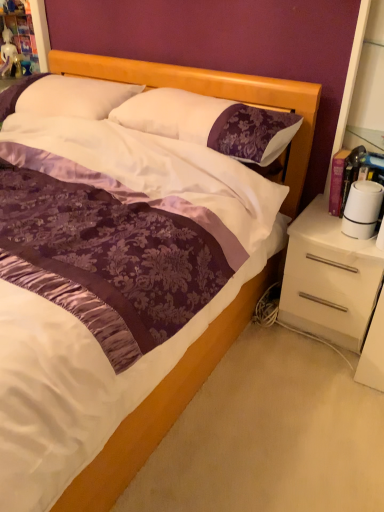
Question: Which direction should I rotate to face white satin pillow at upper center, acting as the second pillow starting from the right, — up or down?

Choices:
 (A) up
 (B) down

Answer: (A)

Question: Is white glossy drawer at right not close to white satin pillow at upper center, placed as the first pillow when sorted from left to right?

Choices:
 (A) yes
 (B) no

Answer: (A)

Question: Considering the relative sizes of white glossy drawer at right and white satin pillow at upper center, placed as the first pillow when sorted from left to right, in the image provided, is white glossy drawer at right shorter than white satin pillow at upper center, placed as the first pillow when sorted from left to right,?

Choices:
 (A) no
 (B) yes

Answer: (A)

Question: Can you confirm if white glossy drawer at right is wider than white satin pillow at upper center, placed as the first pillow when sorted from left to right?

Choices:
 (A) no
 (B) yes

Answer: (B)

Question: Is white glossy drawer at right to the left of white satin pillow at upper center, acting as the second pillow starting from the right, from the viewer's perspective?

Choices:
 (A) yes
 (B) no

Answer: (B)

Question: Does white glossy drawer at right lie behind white satin pillow at upper center, placed as the first pillow when sorted from left to right?

Choices:
 (A) no
 (B) yes

Answer: (A)

Question: Does white glossy drawer at right appear on the right side of white satin pillow at upper center, acting as the second pillow starting from the right?

Choices:
 (A) no
 (B) yes

Answer: (B)

Question: Could you tell me if white satin pillow at upper center, acting as the second pillow starting from the right, is facing white glossy drawer at right?

Choices:
 (A) no
 (B) yes

Answer: (A)

Question: Is white satin pillow at upper center, placed as the first pillow when sorted from left to right, positioned in front of white glossy drawer at right?

Choices:
 (A) no
 (B) yes

Answer: (A)

Question: Considering the relative positions of white satin pillow at upper center, placed as the first pillow when sorted from left to right, and white glossy drawer at right in the image provided, is white satin pillow at upper center, placed as the first pillow when sorted from left to right, to the left of white glossy drawer at right from the viewer's perspective?

Choices:
 (A) yes
 (B) no

Answer: (A)

Question: From the image's perspective, would you say white satin pillow at upper center, acting as the second pillow starting from the right, is shown under white glossy drawer at right?

Choices:
 (A) yes
 (B) no

Answer: (B)

Question: From a real-world perspective, is white satin pillow at upper center, acting as the second pillow starting from the right, beneath white glossy drawer at right?

Choices:
 (A) yes
 (B) no

Answer: (B)

Question: Considering the relative sizes of white satin pillow at upper center, acting as the second pillow starting from the right, and white glossy drawer at right in the image provided, is white satin pillow at upper center, acting as the second pillow starting from the right, shorter than white glossy drawer at right?

Choices:
 (A) yes
 (B) no

Answer: (A)

Question: From the image's perspective, is white satin pillow at upper center, placed as the first pillow when sorted from left to right, over purple satin pillow at center, positioned as the 2th pillow in left-to-right order?

Choices:
 (A) no
 (B) yes

Answer: (B)